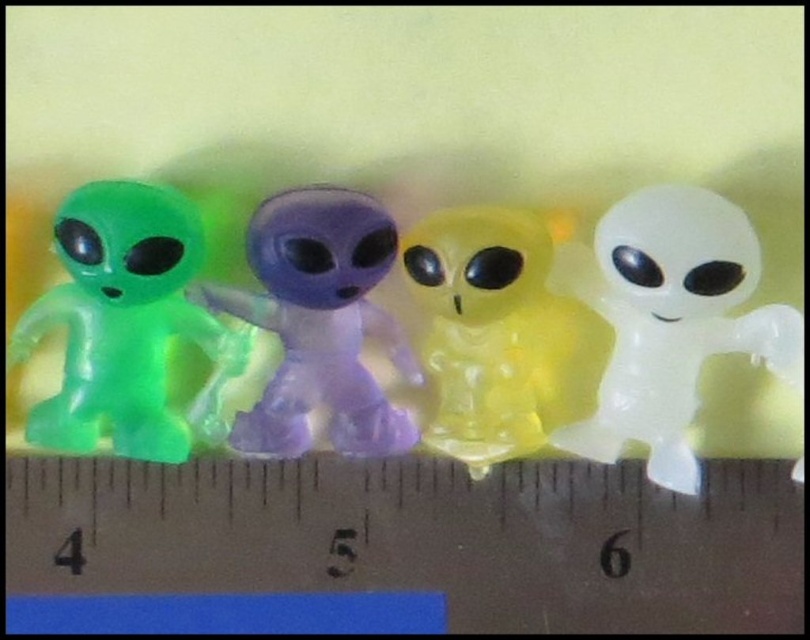
Between translucent yellow alien at center and translucent purple alien at center, which one has less height?

translucent purple alien at center

Is translucent yellow alien at center to the left of translucent purple alien at center from the viewer's perspective?

In fact, translucent yellow alien at center is to the right of translucent purple alien at center.

Which is behind, point (501, 300) or point (335, 416)?

Positioned behind is point (335, 416).

The height and width of the screenshot is (640, 810). What are the coordinates of `translucent yellow alien at center` in the screenshot? It's located at (501, 332).

Find the location of a particular element. This screenshot has height=640, width=810. transparent plastic ruler at lower center is located at coordinates (423, 538).

Is transparent plastic ruler at lower center wider than green translucent alien at left?

Yes.

Does point (450, 548) lie behind point (145, 259)?

Yes, point (450, 548) is farther from viewer.

You are a GUI agent. You are given a task and a screenshot of the screen. Output one action in this format:
    pyautogui.click(x=<x>, y=<y>)
    Task: Click on the transparent plastic ruler at lower center
    The width and height of the screenshot is (810, 640).
    Given the screenshot: What is the action you would take?
    pyautogui.click(x=423, y=538)

Between green translucent alien at left and translucent yellow alien at center, which one is positioned lower?

translucent yellow alien at center is lower down.

Is green translucent alien at left to the left of translucent yellow alien at center from the viewer's perspective?

Correct, you'll find green translucent alien at left to the left of translucent yellow alien at center.

Which is behind, point (152, 362) or point (542, 257)?

Point (152, 362)

The height and width of the screenshot is (640, 810). In order to click on green translucent alien at left in this screenshot , I will do `click(126, 324)`.